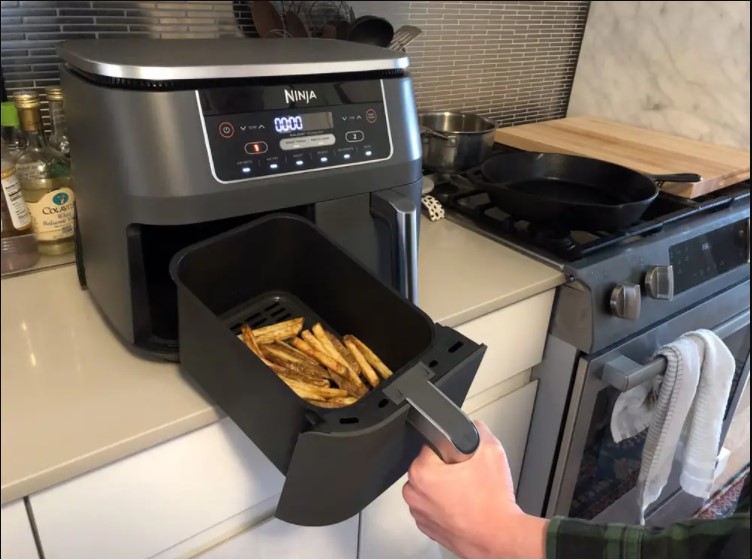
Identify the location of hand towel. (675, 401).